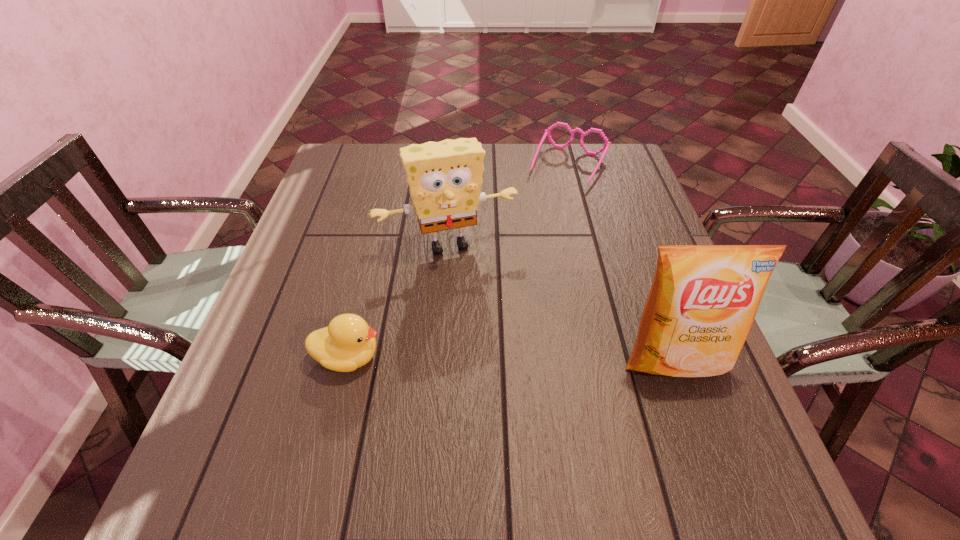
Where is `vacant space at the right edge`? vacant space at the right edge is located at coordinates (717, 376).

Identify the location of vacant space at the far left corner of the desktop. The height and width of the screenshot is (540, 960). (349, 179).

Find the location of `free point between the crisp (potato chip) and the duckling`. free point between the crisp (potato chip) and the duckling is located at coordinates (511, 359).

I want to click on unoccupied position between the farthest object and the sponge, so click(x=509, y=205).

Locate an element on the screen. free space between the sponge and the farthest object is located at coordinates (509, 205).

Find the location of a particular element. This screenshot has width=960, height=540. vacant space in between the sponge and the farthest object is located at coordinates (509, 205).

At what (x,y) coordinates should I click in order to perform the action: click on vacant area between the crisp (potato chip) and the duckling. Please return your answer as a coordinate pair (x, y). This screenshot has height=540, width=960. Looking at the image, I should click on (511, 359).

Where is `free space between the spectacles and the crisp (potato chip)`? The image size is (960, 540). free space between the spectacles and the crisp (potato chip) is located at coordinates (622, 263).

Identify the location of free spot between the sponge and the spectacles. (509, 205).

Where is `free space between the crisp (potato chip) and the farthest object`? The image size is (960, 540). free space between the crisp (potato chip) and the farthest object is located at coordinates (622, 263).